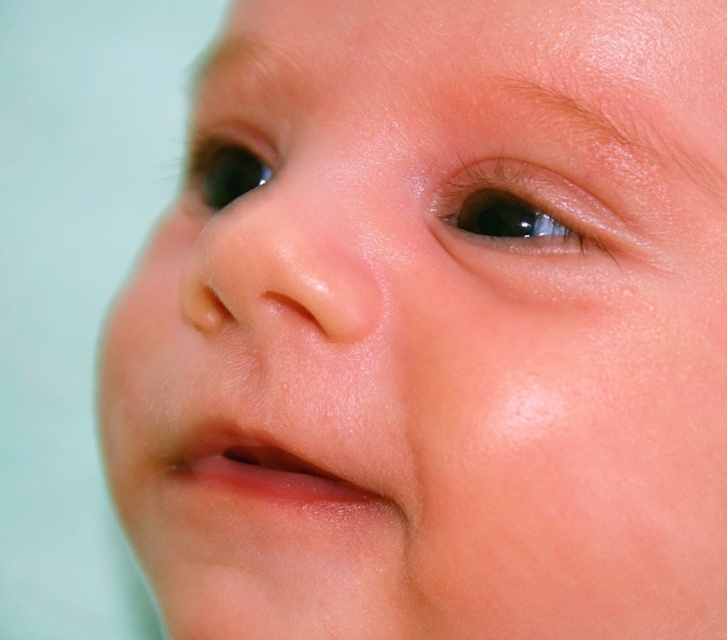
Looking at the baby in the image, which of the two eyes, the glossy brown eye at upper center or the black glossy eye at upper left, has a greater height?

The glossy brown eye at upper center is taller than the black glossy eye at upper left.

You are a photographer adjusting the focus on a camera lens. You need to focus on both the point at coordinates point (483, 234) and point (228, 176) in the image. According to the scene description, which point should you focus on first to ensure the baby appears sharp?

Point (483, 234) is in front of point (228, 176), so you should focus on point (483, 234) first to ensure the baby appears sharp.

You are a photographer adjusting the lighting for a baby photo shoot. You notice the glossy brown eye at upper center and the black glossy eye at upper left. Which eye should you adjust the light to avoid glare? Explain your reasoning.

The glossy brown eye at upper center is positioned on the right side of black glossy eye at upper left. Since the glossy brown eye is on the right, adjusting the light source to the left side would help reduce glare on its surface. The black glossy eye at upper left may also require adjustment, but prioritizing the right eye first would ensure both eyes are evenly lit.